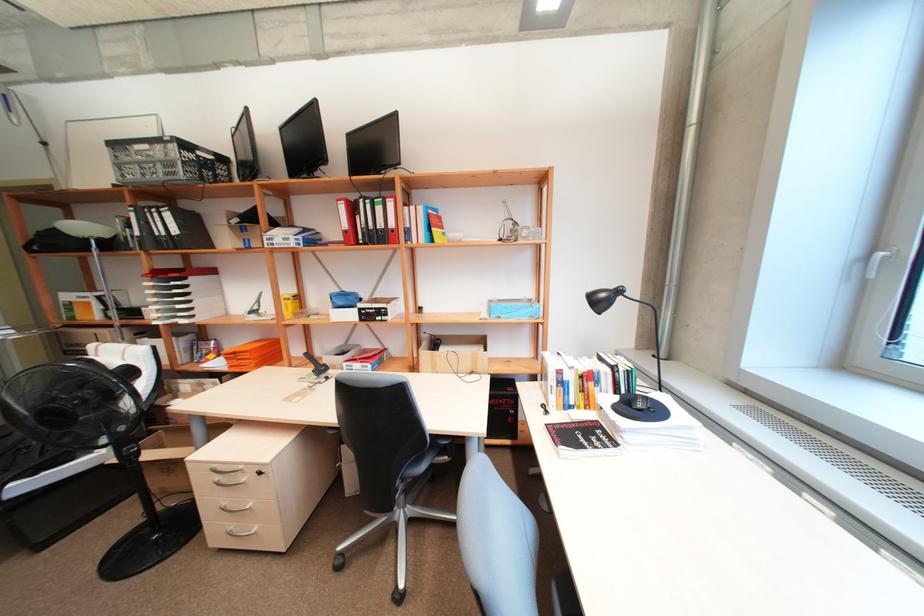
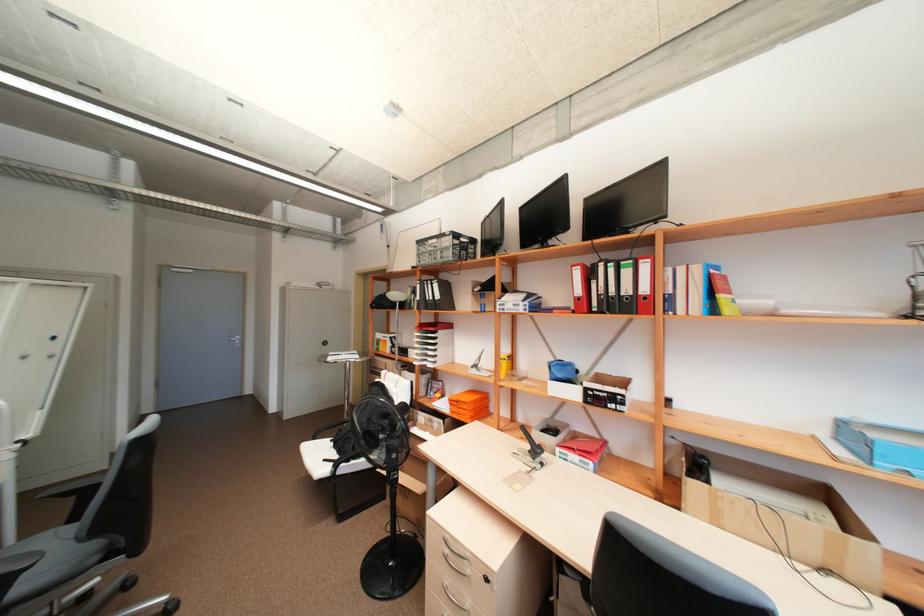
Locate, in the second image, the point that corresponds to [351,349] in the first image.

(557, 424)